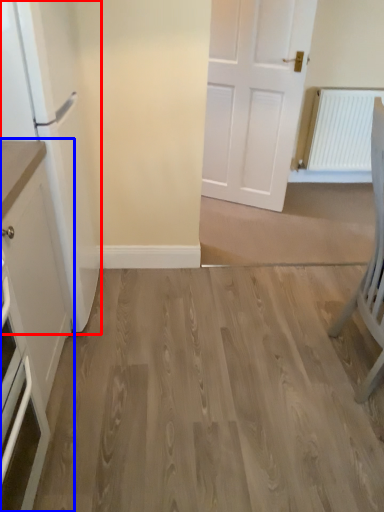
Question: Which of the following is the farthest to the observer, fridge (highlighted by a red box) or cabinetry (highlighted by a blue box)?

Choices:
 (A) fridge
 (B) cabinetry

Answer: (A)